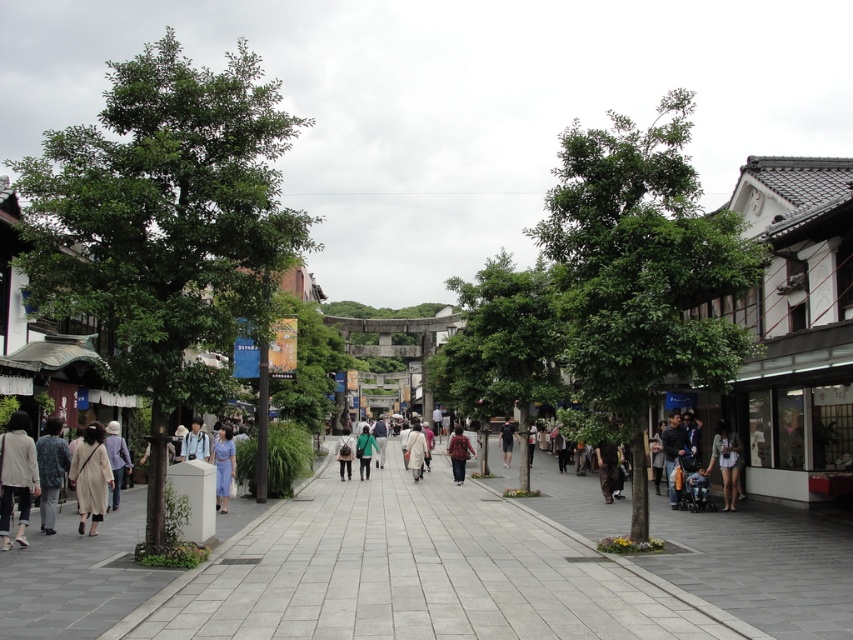
Question: Among these points, which one is nearest to the camera?

Choices:
 (A) (366, 435)
 (B) (505, 449)

Answer: (A)

Question: From the image, what is the correct spatial relationship of white cotton shorts at lower right in relation to dark gray fabric jacket at center?

Choices:
 (A) below
 (B) above

Answer: (B)

Question: Is white matte coat at center above dark gray fabric jacket at center?

Choices:
 (A) no
 (B) yes

Answer: (B)

Question: Which point is farther from the camera taking this photo?

Choices:
 (A) (407, 456)
 (B) (727, 506)
 (C) (462, 452)
 (D) (229, 426)

Answer: (A)

Question: Does blue fabric dress at center have a greater width compared to dark gray fabric jacket at center?

Choices:
 (A) no
 (B) yes

Answer: (B)

Question: Which point is closer to the camera?

Choices:
 (A) (450, 444)
 (B) (506, 449)

Answer: (A)